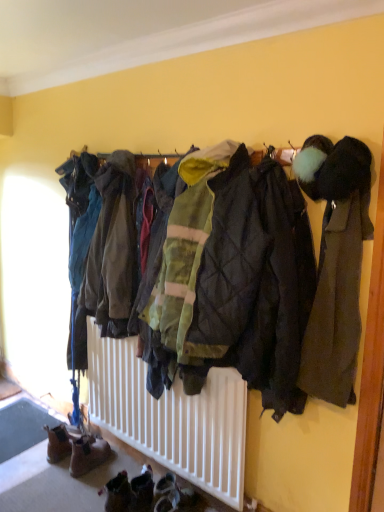
Question: From the image's perspective, is brown suede boots at lower left below green quilted jacket at center, the first jacket positioned from the back?

Choices:
 (A) no
 (B) yes

Answer: (B)

Question: Can you confirm if brown suede boots at lower left is positioned to the right of green quilted jacket at center, which ranks as the second jacket in front-to-back order?

Choices:
 (A) no
 (B) yes

Answer: (A)

Question: From the image's perspective, does brown suede boots at lower left appear higher than green quilted jacket at center, which ranks as the second jacket in front-to-back order?

Choices:
 (A) yes
 (B) no

Answer: (B)

Question: Is brown suede boots at lower left behind green quilted jacket at center, which ranks as the second jacket in front-to-back order?

Choices:
 (A) no
 (B) yes

Answer: (B)

Question: From a real-world perspective, is brown suede boots at lower left located beneath green quilted jacket at center, which ranks as the 1th jacket in left-to-right order?

Choices:
 (A) no
 (B) yes

Answer: (B)

Question: Is brown suede boots at lower left spatially inside green quilted jacket at center, the first jacket positioned from the back, or outside of it?

Choices:
 (A) outside
 (B) inside

Answer: (A)

Question: Is brown suede boots at lower left to the left or to the right of green quilted jacket at center, which ranks as the 1th jacket in left-to-right order, in the image?

Choices:
 (A) left
 (B) right

Answer: (A)

Question: Is brown suede boots at lower left in front of or behind green quilted jacket at center, the second jacket viewed from the right, in the image?

Choices:
 (A) front
 (B) behind

Answer: (B)

Question: Is brown suede boots at lower left bigger or smaller than green quilted jacket at center, the first jacket positioned from the back?

Choices:
 (A) small
 (B) big

Answer: (A)

Question: In the image, is dark gray wool coat at right, which is the 2th jacket from back to front, positioned in front of or behind brown suede boots at lower left?

Choices:
 (A) behind
 (B) front

Answer: (B)

Question: In terms of height, does dark gray wool coat at right, which is the 2th jacket from left to right, look taller or shorter compared to brown suede boots at lower left?

Choices:
 (A) tall
 (B) short

Answer: (A)

Question: Would you say dark gray wool coat at right, the 1th jacket from the right, is to the left or to the right of brown suede boots at lower left in the picture?

Choices:
 (A) right
 (B) left

Answer: (A)

Question: Is point (342, 241) positioned closer to the camera than point (81, 453)?

Choices:
 (A) farther
 (B) closer

Answer: (B)

Question: In the image, is brown suede boots at lower left on the left side or the right side of dark gray wool coat at right, which is counted as the 1th jacket, starting from the front?

Choices:
 (A) left
 (B) right

Answer: (A)

Question: Considering their positions, is brown suede boots at lower left located in front of or behind dark gray wool coat at right, which is the 2th jacket from back to front?

Choices:
 (A) front
 (B) behind

Answer: (B)